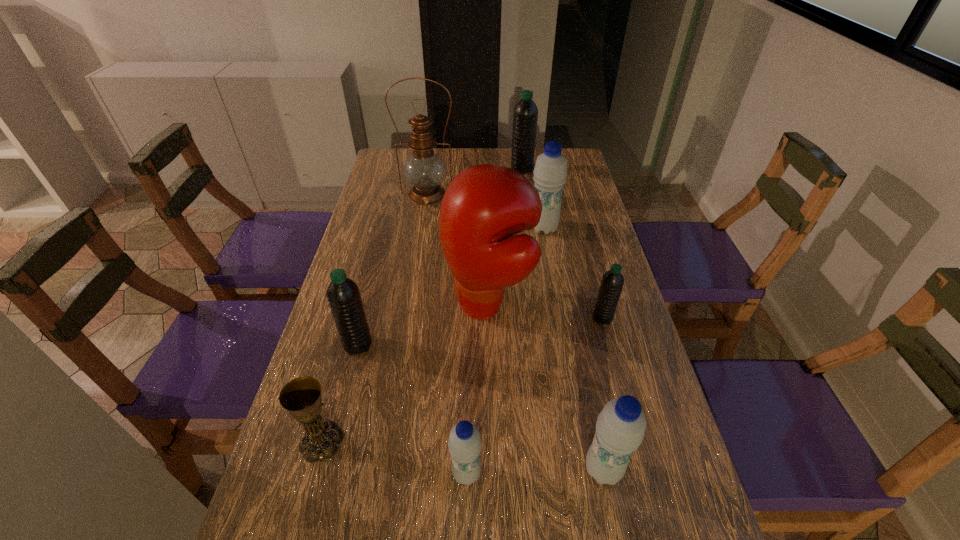
Locate which water bottle is the sixth closest to the red boxing glove. Please provide its 2D coordinates. Your answer should be formatted as a tuple, i.e. [(x, y)], where the tuple contains the x and y coordinates of a point satisfying the conditions above.

[(525, 117)]

Where is `the second closest black water bottle to the second farthest water bottle`? Image resolution: width=960 pixels, height=540 pixels. the second closest black water bottle to the second farthest water bottle is located at coordinates (612, 282).

Identify the location of black water bottle that stands as the second closest to the red boxing glove. coord(343,295).

Identify which blue water bottle is located as the nearest to the chalice. Please provide its 2D coordinates. Your answer should be formatted as a tuple, i.e. [(x, y)], where the tuple contains the x and y coordinates of a point satisfying the conditions above.

[(465, 443)]

Identify the location of blue water bottle identified as the third closest to the second farthest object. This screenshot has width=960, height=540. (620, 428).

This screenshot has width=960, height=540. I want to click on vacant area that satisfies the following two spatial constraints: 1. on the striking surface of the rightmost water bottle; 2. on the left side of the boxing glove, so click(x=489, y=318).

Locate an element on the screen. The height and width of the screenshot is (540, 960). vacant point that satisfies the following two spatial constraints: 1. on the front side of the gold chalice; 2. on the right side of the second water bottle from left to right is located at coordinates pos(313,474).

Identify the location of vacant space that satisfies the following two spatial constraints: 1. on the back side of the rightmost object; 2. on the left side of the second water bottle from left to right. This screenshot has width=960, height=540. point(469,318).

Where is `vacant position in the image that satisfies the following two spatial constraints: 1. on the back side of the farthest object; 2. on the left side of the smallest blue water bottle`? vacant position in the image that satisfies the following two spatial constraints: 1. on the back side of the farthest object; 2. on the left side of the smallest blue water bottle is located at coordinates (473, 170).

The width and height of the screenshot is (960, 540). Identify the location of free space that satisfies the following two spatial constraints: 1. on the striking surface of the second biggest blue water bottle; 2. on the left side of the red boxing glove. (492, 469).